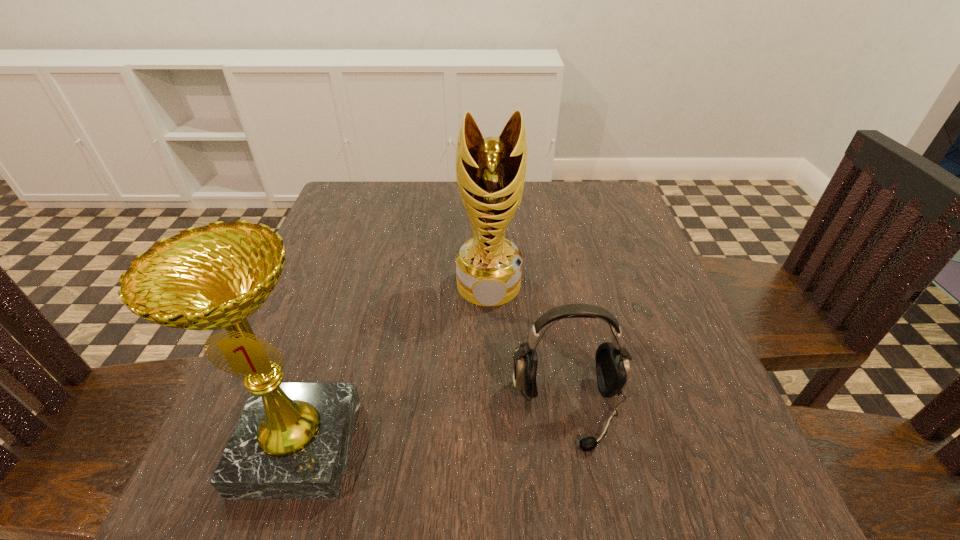
Locate an element on the screen. The width and height of the screenshot is (960, 540). object positioned at the near left corner is located at coordinates (291, 442).

Where is `blank space at the far edge of the desktop`? Image resolution: width=960 pixels, height=540 pixels. blank space at the far edge of the desktop is located at coordinates (426, 210).

The image size is (960, 540). What are the coordinates of `vacant space at the near edge` in the screenshot? It's located at (619, 519).

In the image, there is a desktop. Find the location of `vacant space at the left edge`. vacant space at the left edge is located at coordinates (328, 334).

Find the location of a particular element. vacant area at the right edge of the desktop is located at coordinates (629, 428).

The height and width of the screenshot is (540, 960). In the image, there is a desktop. Find the location of `free space at the far left corner`. free space at the far left corner is located at coordinates (333, 214).

Where is `free location at the near left corner`? This screenshot has width=960, height=540. free location at the near left corner is located at coordinates (186, 515).

I want to click on free space at the far right corner, so click(x=612, y=203).

At what (x,y) coordinates should I click in order to perform the action: click on vacant space at the near right corner. Please return your answer as a coordinate pair (x, y). Looking at the image, I should click on (693, 470).

The height and width of the screenshot is (540, 960). Find the location of `free spot between the left award and the shortest object`. free spot between the left award and the shortest object is located at coordinates (433, 428).